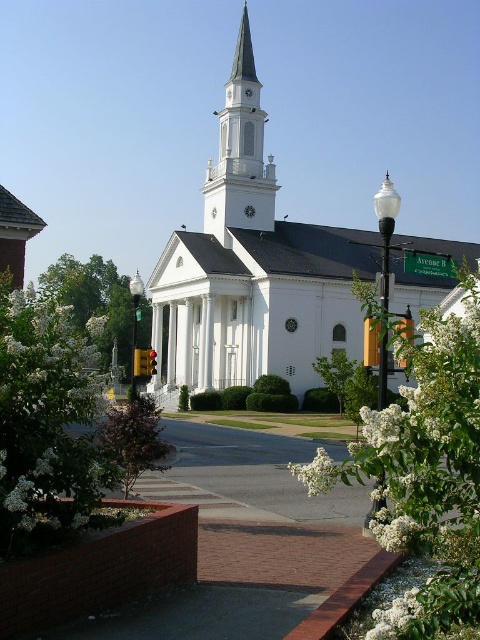
Can you confirm if white steeple at center is positioned to the right of green leafy tree at left?

Yes, white steeple at center is to the right of green leafy tree at left.

Is white steeple at center closer to camera compared to green leafy tree at left?

No, white steeple at center is further to the viewer.

Is point (240, 108) farther from camera compared to point (123, 289)?

No, it is in front of (123, 289).

I want to click on white steeple at center, so click(x=240, y=152).

Is point (226, 193) behind point (332, 378)?

That is True.

Who is positioned more to the right, white steeple at center or green leafy tree at center?

green leafy tree at center is more to the right.

Between point (250, 218) and point (338, 381), which one is positioned in front?

Point (338, 381) is in front.

I want to click on white steeple at center, so (240, 152).

Who is positioned more to the right, white fluffy flowers at center or green leafy tree at center?

white fluffy flowers at center

The height and width of the screenshot is (640, 480). What do you see at coordinates (430, 468) in the screenshot?
I see `white fluffy flowers at center` at bounding box center [430, 468].

Which is in front, point (445, 602) or point (346, 356)?

Point (445, 602)

Image resolution: width=480 pixels, height=640 pixels. I want to click on white fluffy flowers at center, so click(430, 468).